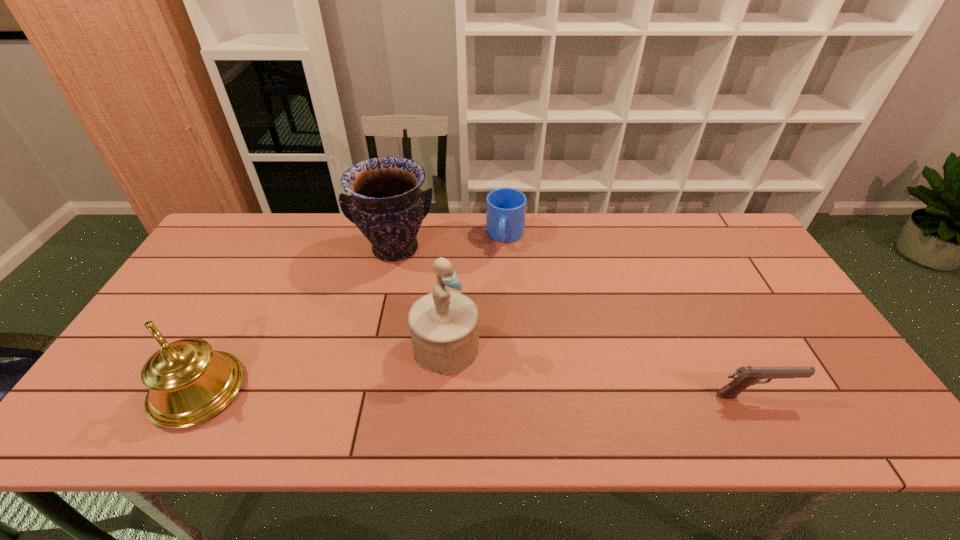
Find the location of a particular element. The image size is (960, 540). free spot that satisfies the following two spatial constraints: 1. on the front side of the rightmost object; 2. at the barrel of the bell is located at coordinates (195, 396).

Find the location of `free location that satisfies the following two spatial constraints: 1. on the front side of the figurine; 2. on the right side of the pottery`. free location that satisfies the following two spatial constraints: 1. on the front side of the figurine; 2. on the right side of the pottery is located at coordinates (373, 347).